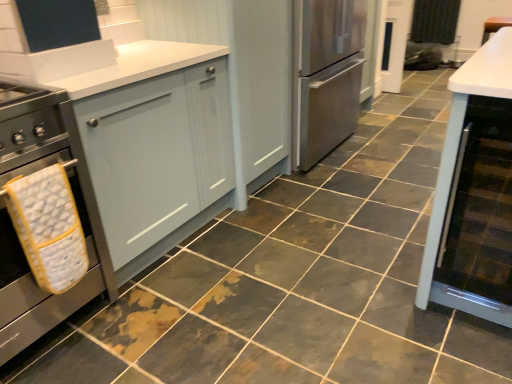
Question: From the image's perspective, is black fabric curtain at upper right under matte gray cabinet at center, placed as the 2th cabinetry when sorted from left to right?

Choices:
 (A) yes
 (B) no

Answer: (B)

Question: Is black fabric curtain at upper right taller than matte gray cabinet at center, placed as the 2th cabinetry when sorted from left to right?

Choices:
 (A) yes
 (B) no

Answer: (B)

Question: From the image's perspective, is black fabric curtain at upper right located above matte gray cabinet at center, placed as the 2th cabinetry when sorted from left to right?

Choices:
 (A) yes
 (B) no

Answer: (A)

Question: Does black fabric curtain at upper right have a lesser width compared to matte gray cabinet at center, positioned as the second cabinetry in right-to-left order?

Choices:
 (A) yes
 (B) no

Answer: (A)

Question: Is black fabric curtain at upper right positioned in front of matte gray cabinet at center, positioned as the second cabinetry in right-to-left order?

Choices:
 (A) yes
 (B) no

Answer: (B)

Question: From the image's perspective, is matte gray cabinet at left, the third cabinetry when ordered from right to left, positioned above or below stainless steel oven at left?

Choices:
 (A) above
 (B) below

Answer: (A)

Question: Looking at their shapes, would you say matte gray cabinet at left, the third cabinetry when ordered from right to left, is wider or thinner than stainless steel oven at left?

Choices:
 (A) thin
 (B) wide

Answer: (B)

Question: Is matte gray cabinet at left, the third cabinetry when ordered from right to left, situated inside stainless steel oven at left or outside?

Choices:
 (A) outside
 (B) inside

Answer: (A)

Question: Based on their sizes in the image, would you say matte gray cabinet at left, which is the 1th cabinetry in left-to-right order, is bigger or smaller than stainless steel oven at left?

Choices:
 (A) big
 (B) small

Answer: (A)

Question: Which is correct: yellow fabric oven mitt at left is inside matte gray cabinet at left, which is the 1th cabinetry in left-to-right order, or outside of it?

Choices:
 (A) outside
 (B) inside

Answer: (A)

Question: Relative to matte gray cabinet at left, the third cabinetry when ordered from right to left, is yellow fabric oven mitt at left in front or behind?

Choices:
 (A) front
 (B) behind

Answer: (A)

Question: Does point (29, 256) appear closer or farther from the camera than point (218, 180)?

Choices:
 (A) closer
 (B) farther

Answer: (A)

Question: Considering the relative positions of yellow fabric oven mitt at left and matte gray cabinet at left, which is the 1th cabinetry in left-to-right order, in the image provided, is yellow fabric oven mitt at left to the left or to the right of matte gray cabinet at left, which is the 1th cabinetry in left-to-right order,?

Choices:
 (A) right
 (B) left

Answer: (B)

Question: Is matte gray cabinet at center, positioned as the second cabinetry in right-to-left order, wider or thinner than matte glass cabinet at right, which is the third cabinetry in left-to-right order?

Choices:
 (A) thin
 (B) wide

Answer: (B)

Question: From a real-world perspective, is matte gray cabinet at center, placed as the 2th cabinetry when sorted from left to right, physically located above or below matte glass cabinet at right, positioned as the 1th cabinetry in right-to-left order?

Choices:
 (A) below
 (B) above

Answer: (B)